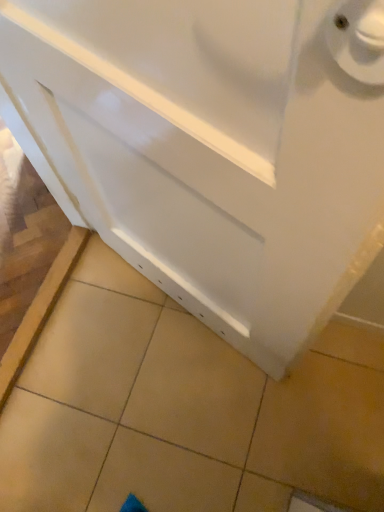
Identify the location of white glossy door at center. This screenshot has height=512, width=384. (213, 148).

The width and height of the screenshot is (384, 512). Describe the element at coordinates (213, 148) in the screenshot. I see `white glossy door at center` at that location.

This screenshot has height=512, width=384. What are the coordinates of `white glossy door at center` in the screenshot? It's located at (213, 148).